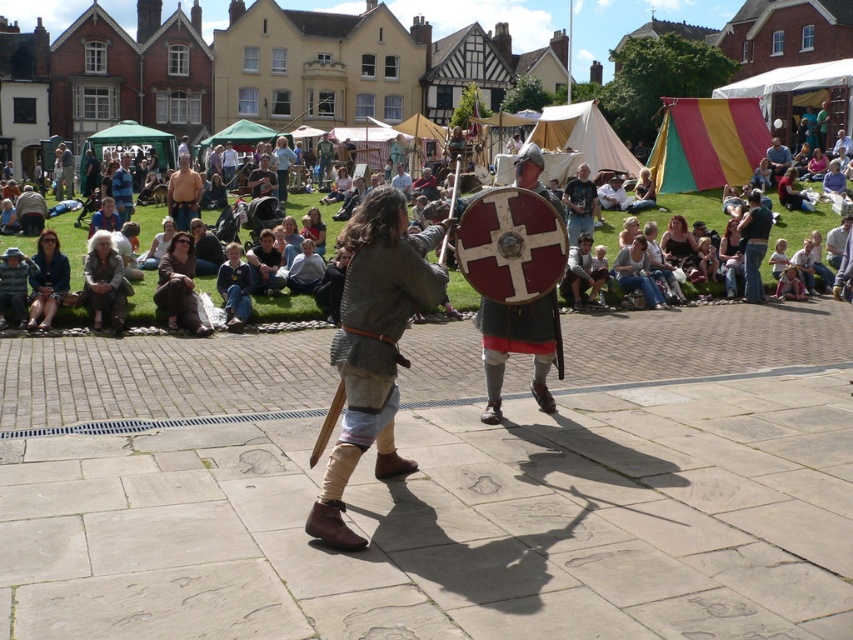
You are a photographer standing at the edge of the town square. You want to take a photo of the light brown fabric seats at center and the smooth brown leather jacket at center. If your camera has a maximum focus range of 15 meters, will both objects be in focus?

The light brown fabric seats at center is 16.64 meters away from the smooth brown leather jacket at center. Since the maximum focus range is 15 meters, both objects are beyond the camera range and cannot be in focus.

Looking at this image, you are standing at the point labeled as point (779, 176) and want to move towards the direction of point (576, 243). Which direction should you face to walk towards it?

You should face towards the lower right direction to walk from point (779, 176) to point (576, 243) since point (576, 243) is in front of point (779, 176).

You are standing in the town square where the historical reenactment is taking place. You notice two points marked in the scene. From your vantage point, which of the two points, point [178,202] or point [775,179], is closer to you?

Point [178,202] is closer to you than point [775,179].